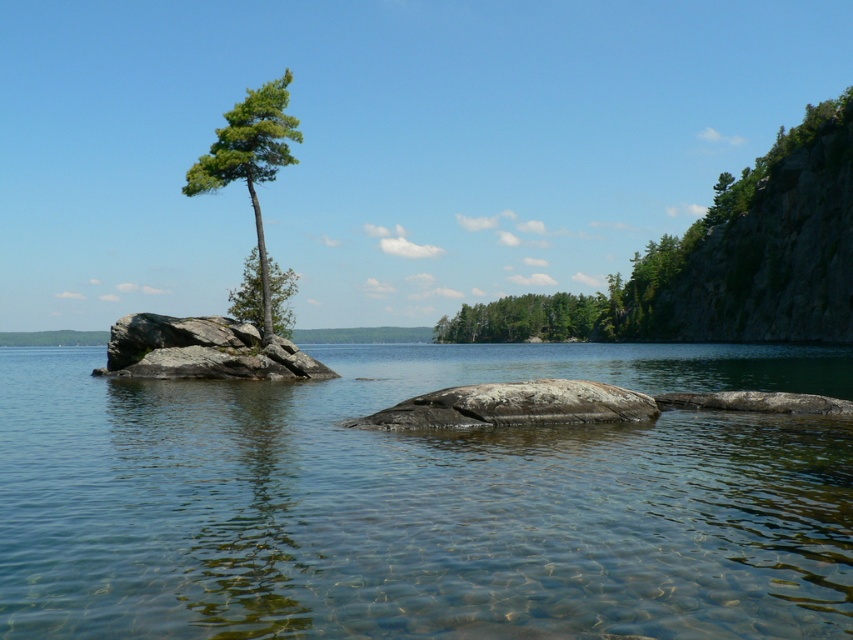
What do you see at coordinates (721, 260) in the screenshot? I see `green leafy tree at right` at bounding box center [721, 260].

Which is behind, point (560, 320) or point (280, 120)?

The point (560, 320) is behind.

Between point (729, 296) and point (282, 156), which one is positioned behind?

The point (729, 296) is behind.

I want to click on green leafy tree at right, so click(x=721, y=260).

Does clear water at center have a smaller size compared to gray rock at center?

A: Actually, clear water at center might be larger than gray rock at center.

Identify the location of clear water at center. The height and width of the screenshot is (640, 853). (422, 500).

What do you see at coordinates (422, 500) in the screenshot?
I see `clear water at center` at bounding box center [422, 500].

Identify the location of clear water at center. (422, 500).

Which is above, green matte tree at center or green matte tree at center-left?

green matte tree at center is above.

Based on the photo, which is more to the left, green matte tree at center or green matte tree at center-left?

From the viewer's perspective, green matte tree at center-left appears more on the left side.

The height and width of the screenshot is (640, 853). In order to click on green matte tree at center in this screenshot , I will do `click(523, 317)`.